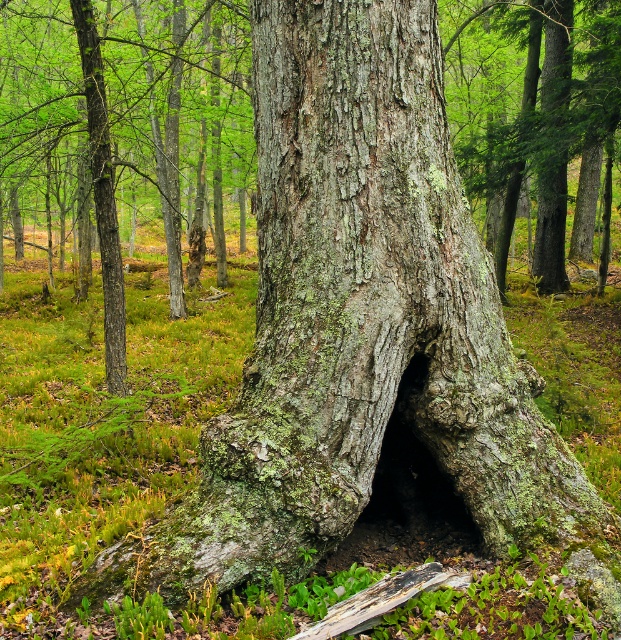
Can you confirm if green mossy bark tree at center is taller than green mossy log at center?

Indeed, green mossy bark tree at center has a greater height compared to green mossy log at center.

Who is more distant from viewer, (191, 22) or (392, 586)?

The point (191, 22) is more distant.

Find the location of `green mossy bark tree at center`. green mossy bark tree at center is located at coordinates (176, 125).

Does green mossy bark tree at center lie behind green mossy tree trunk at center?

No, it is not.

Which is more to the right, green mossy bark tree at center or green mossy tree trunk at center?

Positioned to the right is green mossy tree trunk at center.

Find the location of `green mossy bark tree at center`. green mossy bark tree at center is located at coordinates (176, 125).

In order to click on green mossy bark tree at center in this screenshot , I will do `click(176, 125)`.

Can you confirm if green mossy tree trunk at center is positioned to the left of green mossy log at center?

Incorrect, green mossy tree trunk at center is not on the left side of green mossy log at center.

At what (x,y) coordinates should I click in order to perform the action: click on green mossy tree trunk at center. Please return your answer as a coordinate pair (x, y). The height and width of the screenshot is (640, 621). Looking at the image, I should click on (528, 109).

The height and width of the screenshot is (640, 621). Identify the location of green mossy tree trunk at center. (528, 109).